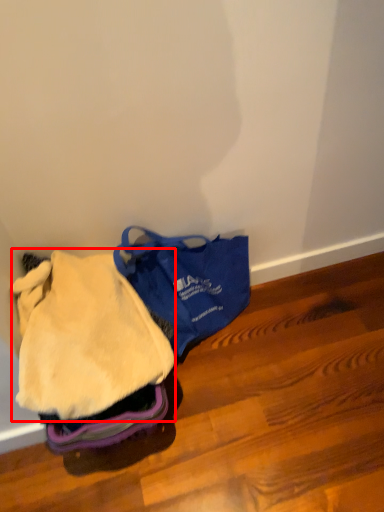
Question: From the image's perspective, where is clothing (annotated by the red box) located relative to luggage and bags?

Choices:
 (A) below
 (B) above

Answer: (A)